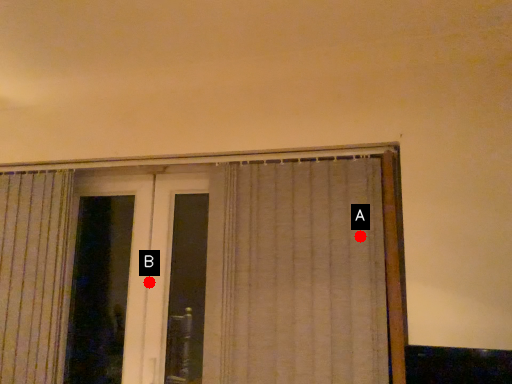
Question: Two points are circled on the image, labeled by A and B beside each circle. Among these points, which one is farthest from the camera?

Choices:
 (A) A is further
 (B) B is further

Answer: (B)